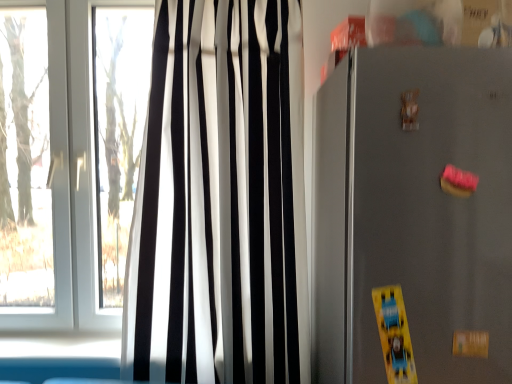
Question: Considering the relative sizes of black/white striped curtain at left and satin gray refrigerator at right in the image provided, is black/white striped curtain at left bigger than satin gray refrigerator at right?

Choices:
 (A) no
 (B) yes

Answer: (A)

Question: From the image's perspective, would you say black/white striped curtain at left is shown under satin gray refrigerator at right?

Choices:
 (A) yes
 (B) no

Answer: (B)

Question: Is black/white striped curtain at left positioned behind satin gray refrigerator at right?

Choices:
 (A) yes
 (B) no

Answer: (A)

Question: Is black/white striped curtain at left facing away from satin gray refrigerator at right?

Choices:
 (A) no
 (B) yes

Answer: (A)

Question: Is black/white striped curtain at left facing towards satin gray refrigerator at right?

Choices:
 (A) no
 (B) yes

Answer: (A)

Question: Considering the relative sizes of black/white striped curtain at left and satin gray refrigerator at right in the image provided, is black/white striped curtain at left taller than satin gray refrigerator at right?

Choices:
 (A) no
 (B) yes

Answer: (B)

Question: Is satin gray refrigerator at right bigger than black/white striped curtain at left?

Choices:
 (A) no
 (B) yes

Answer: (B)

Question: Is satin gray refrigerator at right outside of black/white striped curtain at left?

Choices:
 (A) yes
 (B) no

Answer: (A)

Question: Is satin gray refrigerator at right facing away from black/white striped curtain at left?

Choices:
 (A) yes
 (B) no

Answer: (B)

Question: Does satin gray refrigerator at right lie in front of black/white striped curtain at left?

Choices:
 (A) yes
 (B) no

Answer: (A)

Question: Is satin gray refrigerator at right positioned behind black/white striped curtain at left?

Choices:
 (A) no
 (B) yes

Answer: (A)

Question: Does satin gray refrigerator at right appear on the right side of black/white striped curtain at left?

Choices:
 (A) yes
 (B) no

Answer: (A)

Question: Visually, is black/white striped curtain at left positioned to the left or to the right of satin gray refrigerator at right?

Choices:
 (A) right
 (B) left

Answer: (B)